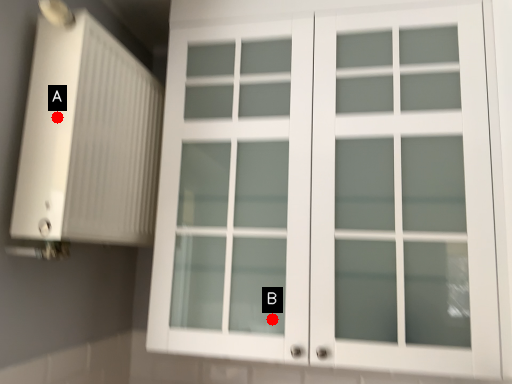
Question: Two points are circled on the image, labeled by A and B beside each circle. Which point is further to the camera?

Choices:
 (A) A is further
 (B) B is further

Answer: (B)